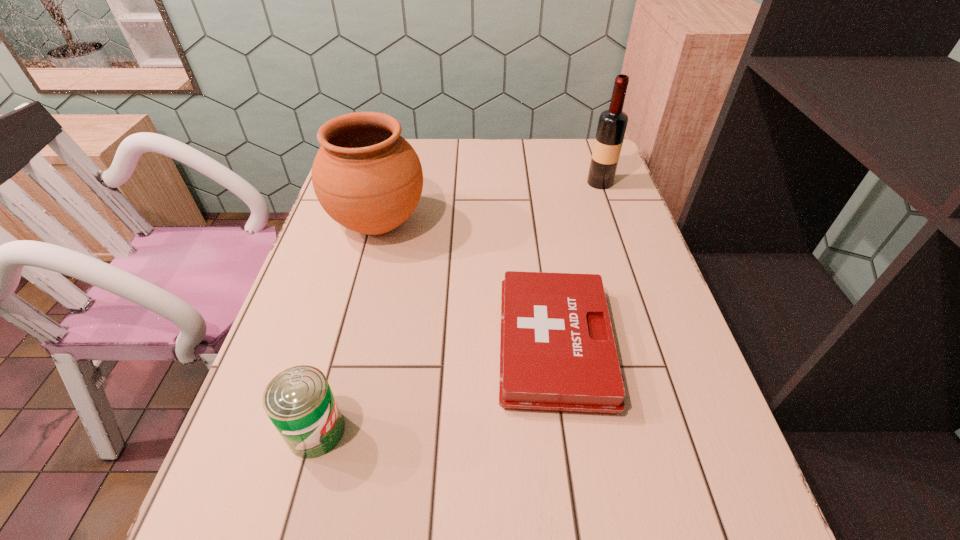
The image size is (960, 540). I want to click on vacant region at the near left corner, so click(x=275, y=537).

This screenshot has width=960, height=540. Identify the location of vacant area between the farthest object and the third nearest object. (489, 203).

This screenshot has height=540, width=960. Find the location of `blank region between the pottery and the second shortest object`. blank region between the pottery and the second shortest object is located at coordinates (348, 327).

Locate an element on the screen. The height and width of the screenshot is (540, 960). vacant area between the first-aid kit and the second farthest object is located at coordinates (467, 285).

Find the location of a particular element. free space between the second object from right to left and the third tallest object is located at coordinates (436, 388).

Locate an element on the screen. This screenshot has height=540, width=960. vacant space that's between the can and the shortest object is located at coordinates (436, 388).

Find the location of `vacant space in between the pottery and the third tallest object`. vacant space in between the pottery and the third tallest object is located at coordinates (348, 327).

The height and width of the screenshot is (540, 960). What are the coordinates of `free space that is in between the can and the second farthest object` in the screenshot? It's located at (348, 327).

At what (x,y) coordinates should I click in order to perform the action: click on free space between the rightmost object and the third shortest object. Please return your answer as a coordinate pair (x, y). Looking at the image, I should click on (489, 203).

At what (x,y) coordinates should I click in order to perform the action: click on vacant space in between the second shortest object and the first-aid kit. Please return your answer as a coordinate pair (x, y). This screenshot has width=960, height=540. Looking at the image, I should click on (436, 388).